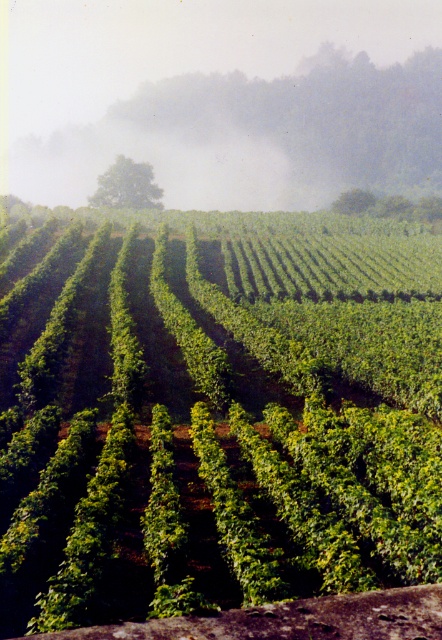
Is green leafy vines at center behind foggy mist at upper center?

No.

Who is taller, green leafy vines at center or foggy mist at upper center?

foggy mist at upper center is taller.

Where is `green leafy vines at center`? The width and height of the screenshot is (442, 640). green leafy vines at center is located at coordinates 213,419.